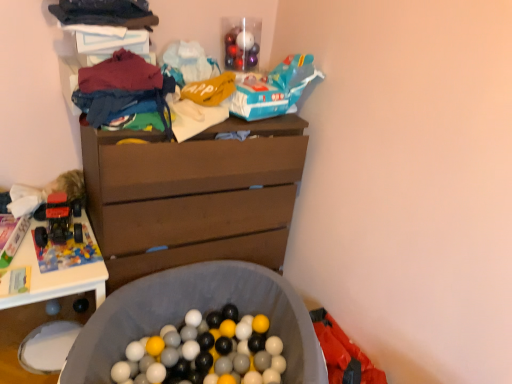
Question: Considering the positions of point (103, 112) and point (274, 192), is point (103, 112) closer or farther from the camera than point (274, 192)?

Choices:
 (A) farther
 (B) closer

Answer: (B)

Question: From a real-world perspective, is matte blue jeans at upper left, positioned as the 1th clothing in bottom-to-top order, physically located above or below brown wood chest of drawers at center?

Choices:
 (A) below
 (B) above

Answer: (B)

Question: Based on their relative distances, which object is nearer to the white plastic table at left?

Choices:
 (A) brown wood chest of drawers at center
 (B) matte blue jeans at upper left, positioned as the 1th clothing in bottom-to-top order
 (C) gray fabric laundry basket at lower center
 (D) dark blue fabric at upper left, positioned as the 2th clothing in bottom-to-top order

Answer: (C)

Question: Which of these objects is positioned closest to the matte blue jeans at upper left, which is the 2th clothing from top to bottom?

Choices:
 (A) brown wood chest of drawers at center
 (B) white plastic table at left
 (C) dark blue fabric at upper left, positioned as the 2th clothing in bottom-to-top order
 (D) gray fabric laundry basket at lower center

Answer: (C)